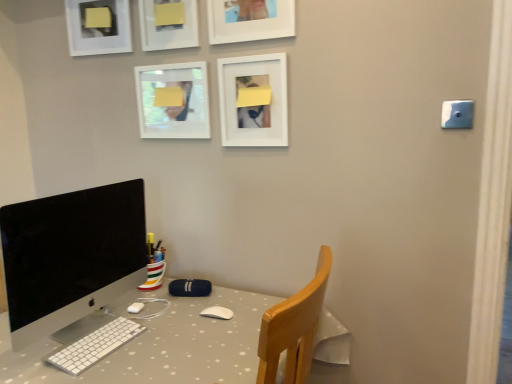
Question: Considering the relative sizes of matte white picture frame at upper center, which ranks as the 3th picture frame in left-to-right order, and blue plastic light switch at upper right in the image provided, is matte white picture frame at upper center, which ranks as the 3th picture frame in left-to-right order, shorter than blue plastic light switch at upper right?

Choices:
 (A) no
 (B) yes

Answer: (A)

Question: From the image's perspective, is matte white picture frame at upper center, which ranks as the 3th picture frame in left-to-right order, on top of blue plastic light switch at upper right?

Choices:
 (A) yes
 (B) no

Answer: (A)

Question: From a real-world perspective, is matte white picture frame at upper center, which ranks as the 3th picture frame in left-to-right order, on top of blue plastic light switch at upper right?

Choices:
 (A) no
 (B) yes

Answer: (B)

Question: Is matte white picture frame at upper center, which ranks as the third picture frame in right-to-left order, facing towards blue plastic light switch at upper right?

Choices:
 (A) no
 (B) yes

Answer: (A)

Question: Can you see matte white picture frame at upper center, which ranks as the third picture frame in right-to-left order, touching blue plastic light switch at upper right?

Choices:
 (A) no
 (B) yes

Answer: (A)

Question: Relative to blue plastic light switch at upper right, is white polka dot desk at center in front or behind?

Choices:
 (A) behind
 (B) front

Answer: (B)

Question: Which is correct: white polka dot desk at center is inside blue plastic light switch at upper right, or outside of it?

Choices:
 (A) inside
 (B) outside

Answer: (B)

Question: Looking at their shapes, would you say white polka dot desk at center is wider or thinner than blue plastic light switch at upper right?

Choices:
 (A) thin
 (B) wide

Answer: (B)

Question: From the image's perspective, is white polka dot desk at center located above or below blue plastic light switch at upper right?

Choices:
 (A) above
 (B) below

Answer: (B)

Question: Do you think matte white picture frame at upper center, which ranks as the third picture frame in right-to-left order, is within white matte picture frame at upper center, which is the fourth picture frame in left-to-right order, or outside of it?

Choices:
 (A) inside
 (B) outside

Answer: (B)

Question: Visually, is matte white picture frame at upper center, which ranks as the 3th picture frame in left-to-right order, positioned to the left or to the right of white matte picture frame at upper center, the 2th picture frame when ordered from right to left?

Choices:
 (A) left
 (B) right

Answer: (A)

Question: From a real-world perspective, is matte white picture frame at upper center, which ranks as the third picture frame in right-to-left order, above or below white matte picture frame at upper center, the 2th picture frame when ordered from right to left?

Choices:
 (A) below
 (B) above

Answer: (A)

Question: Is matte white picture frame at upper center, which ranks as the third picture frame in right-to-left order, bigger or smaller than white matte picture frame at upper center, which is the fourth picture frame in left-to-right order?

Choices:
 (A) small
 (B) big

Answer: (A)

Question: In the image, is white glossy picture frame at upper center, which appears as the 2th picture frame when viewed from the left, positioned in front of or behind white polka dot desk at center?

Choices:
 (A) behind
 (B) front

Answer: (A)

Question: Is white glossy picture frame at upper center, which appears as the 2th picture frame when viewed from the left, inside or outside of white polka dot desk at center?

Choices:
 (A) inside
 (B) outside

Answer: (B)